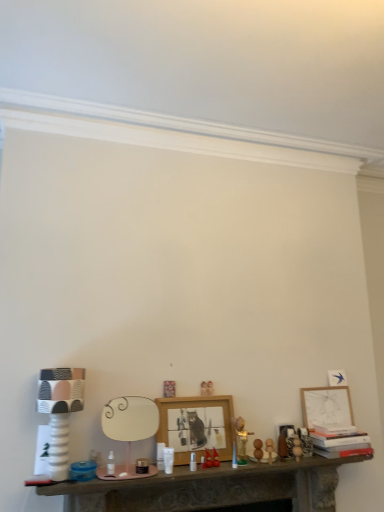
Question: Is smooth wooden eggs at center, positioned as the first toy in left-to-right order, far from matte white picture frame at right, acting as the first picture frame starting from the right?

Choices:
 (A) yes
 (B) no

Answer: (B)

Question: From the image's perspective, is smooth wooden eggs at center, positioned as the first toy in left-to-right order, located beneath matte white picture frame at right, the first picture frame from the back?

Choices:
 (A) no
 (B) yes

Answer: (B)

Question: Could you tell me if smooth wooden eggs at center, positioned as the first toy in left-to-right order, is turned towards matte white picture frame at right, arranged as the 2th picture frame when viewed from the front?

Choices:
 (A) yes
 (B) no

Answer: (B)

Question: From a real-world perspective, is smooth wooden eggs at center, positioned as the first toy in left-to-right order, positioned over matte white picture frame at right, arranged as the 2th picture frame when viewed from the front, based on gravity?

Choices:
 (A) yes
 (B) no

Answer: (B)

Question: Can you confirm if smooth wooden eggs at center, positioned as the first toy in left-to-right order, is wider than matte white picture frame at right, which ranks as the 2th picture frame in left-to-right order?

Choices:
 (A) no
 (B) yes

Answer: (B)

Question: Looking at the image, does smooth stone table at center seem bigger or smaller compared to wooden ball at center, the 1th toy viewed from the right?

Choices:
 (A) small
 (B) big

Answer: (B)

Question: Considering the relative positions of smooth stone table at center and wooden ball at center, the 1th toy viewed from the right, in the image provided, is smooth stone table at center to the left or to the right of wooden ball at center, the 1th toy viewed from the right,?

Choices:
 (A) left
 (B) right

Answer: (A)

Question: Choose the correct answer: Is smooth stone table at center inside wooden ball at center, which ranks as the second toy in left-to-right order, or outside it?

Choices:
 (A) inside
 (B) outside

Answer: (B)

Question: From the image's perspective, is smooth stone table at center located above or below wooden ball at center, which ranks as the second toy in left-to-right order?

Choices:
 (A) below
 (B) above

Answer: (A)

Question: In terms of height, does wooden ball at center, which ranks as the second toy in left-to-right order, look taller or shorter compared to smooth wooden eggs at center, positioned as the first toy in left-to-right order?

Choices:
 (A) short
 (B) tall

Answer: (B)

Question: Is wooden ball at center, the 1th toy viewed from the right, bigger or smaller than smooth wooden eggs at center, arranged as the 2th toy when viewed from the right?

Choices:
 (A) big
 (B) small

Answer: (A)

Question: In the image, is wooden ball at center, which ranks as the second toy in left-to-right order, on the left side or the right side of smooth wooden eggs at center, positioned as the first toy in left-to-right order?

Choices:
 (A) left
 (B) right

Answer: (B)

Question: From the image's perspective, is wooden ball at center, which ranks as the second toy in left-to-right order, above or below smooth wooden eggs at center, positioned as the first toy in left-to-right order?

Choices:
 (A) below
 (B) above

Answer: (A)

Question: Based on their sizes in the image, would you say white textured lamp at left is bigger or smaller than wooden ball at center, which ranks as the second toy in left-to-right order?

Choices:
 (A) small
 (B) big

Answer: (B)

Question: Do you think white textured lamp at left is within wooden ball at center, the 1th toy viewed from the right, or outside of it?

Choices:
 (A) outside
 (B) inside

Answer: (A)